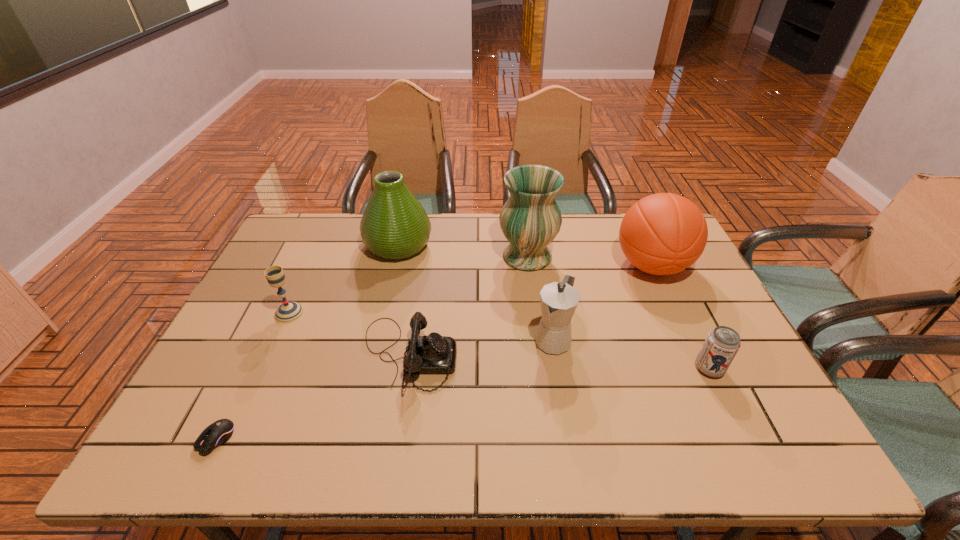
Locate an element on the screen. the right vase is located at coordinates (530, 219).

I want to click on the left vase, so click(394, 226).

At what (x,y) coordinates should I click in order to perform the action: click on basketball. Please return your answer as a coordinate pair (x, y). The height and width of the screenshot is (540, 960). Looking at the image, I should click on (662, 234).

You are a GUI agent. You are given a task and a screenshot of the screen. Output one action in this format:
    pyautogui.click(x=<x>, y=<y>)
    Task: Click on the fifth shortest object
    
    Given the screenshot: What is the action you would take?
    pyautogui.click(x=559, y=300)

At what (x,y) coordinates should I click in order to perform the action: click on chalice. Please return your answer as a coordinate pair (x, y). The image size is (960, 540). Looking at the image, I should click on (288, 312).

Locate an element on the screen. This screenshot has width=960, height=540. the third shortest object is located at coordinates (722, 343).

The height and width of the screenshot is (540, 960). I want to click on the seventh tallest object, so click(434, 354).

The image size is (960, 540). I want to click on the shortest object, so click(x=219, y=432).

You are a GUI agent. You are given a task and a screenshot of the screen. Output one action in this format:
    pyautogui.click(x=<x>, y=<y>)
    Task: Click on the nearest object
    
    Given the screenshot: What is the action you would take?
    pyautogui.click(x=219, y=432)

Where is `free point located on the back of the right vase`? Image resolution: width=960 pixels, height=540 pixels. free point located on the back of the right vase is located at coordinates (522, 215).